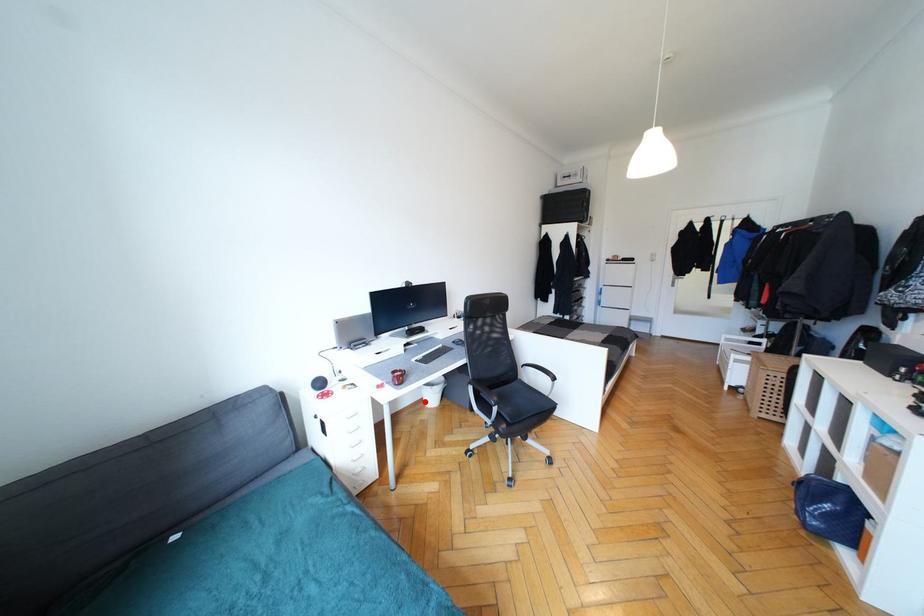
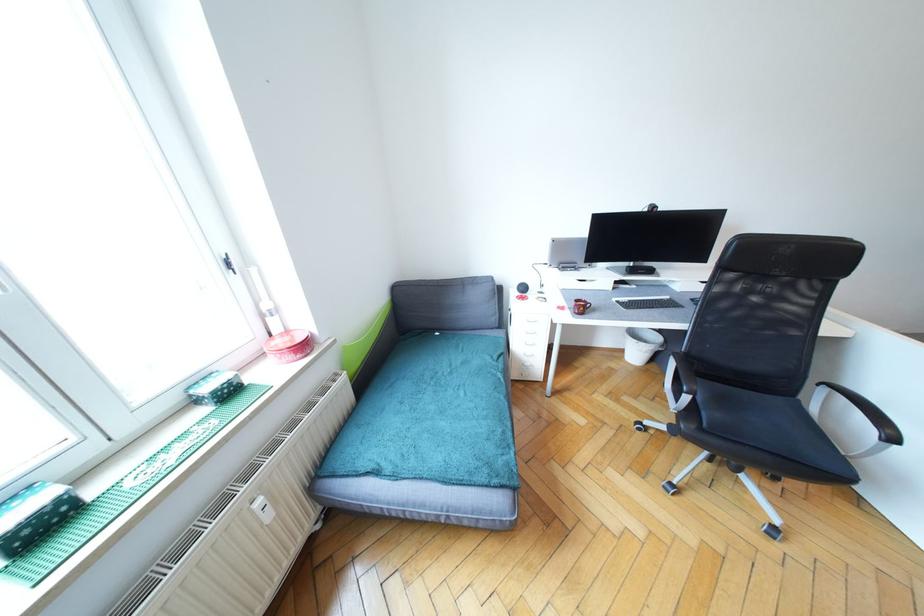
Question: I am providing you with two images of the same scene from different viewpoints. In image1, a red point is highlighted. Considering the same 3D point in image2, which of the following is correct?

Choices:
 (A) It is closer
 (B) It is farther

Answer: (A)